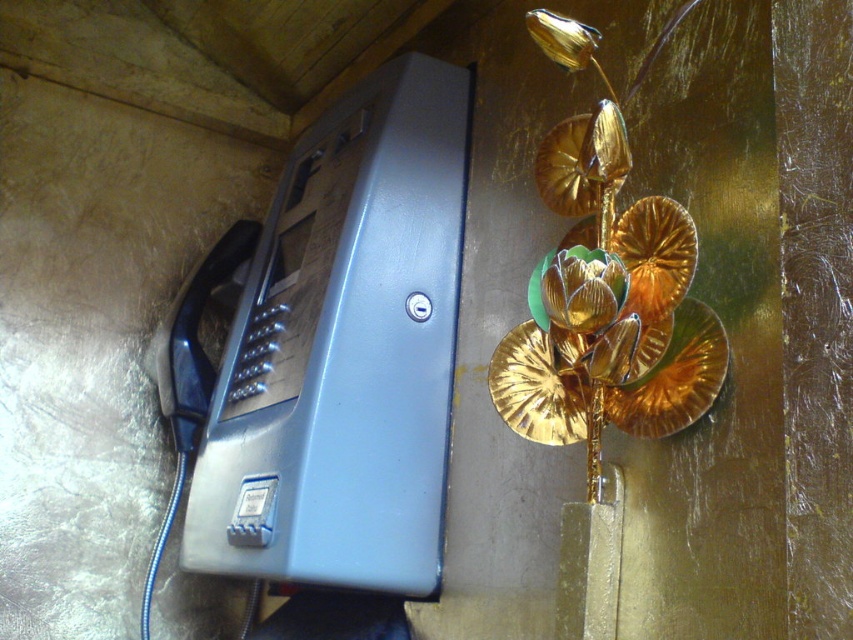
Question: Which object appears closest to the camera in this image?

Choices:
 (A) gold metallic flower at center
 (B) matte plastic phone box at left

Answer: (A)

Question: Can you confirm if matte plastic phone box at left is positioned to the right of gold metallic flower at center?

Choices:
 (A) no
 (B) yes

Answer: (A)

Question: Is matte plastic phone box at left smaller than gold metallic flower at center?

Choices:
 (A) no
 (B) yes

Answer: (A)

Question: Which point is closer to the camera?

Choices:
 (A) gold metallic flower at center
 (B) matte plastic phone box at left

Answer: (A)

Question: Does matte plastic phone box at left have a lesser width compared to gold metallic flower at center?

Choices:
 (A) no
 (B) yes

Answer: (A)